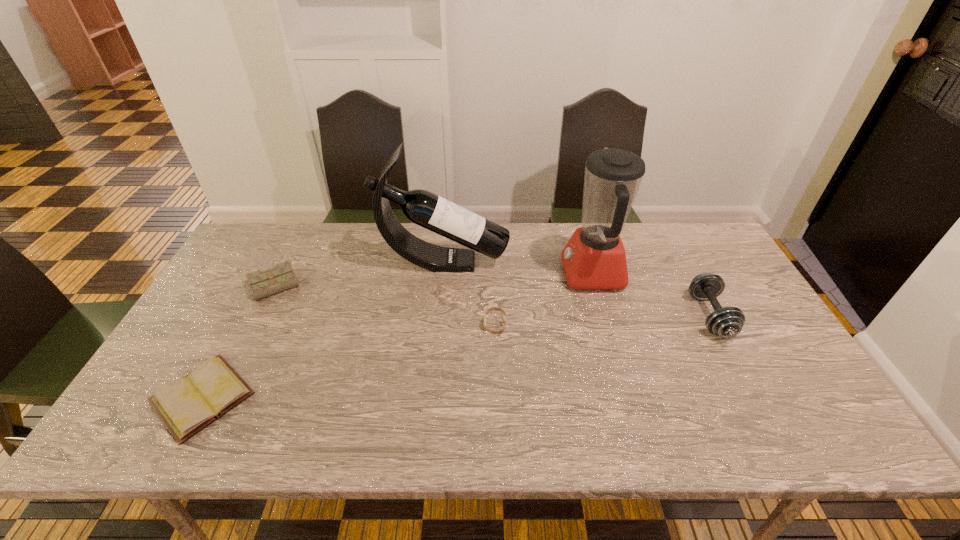
In order to click on blender in this screenshot , I will do `click(594, 258)`.

Find the location of `wine bottle`. wine bottle is located at coordinates (424, 208).

I want to click on the fourth shortest object, so click(x=727, y=322).

In order to click on the rightmost object in this screenshot , I will do `click(727, 322)`.

You are a GUI agent. You are given a task and a screenshot of the screen. Output one action in this format:
    pyautogui.click(x=<x>, y=<y>)
    Task: Click on the taller diary
    The image size is (960, 540).
    Given the screenshot: What is the action you would take?
    pyautogui.click(x=272, y=281)

This screenshot has width=960, height=540. I want to click on watch, so pyautogui.click(x=493, y=308).

This screenshot has width=960, height=540. I want to click on the nearer diary, so click(186, 406).

At what (x,y) coordinates should I click in order to perform the action: click on the shorter diary. Please return your answer as a coordinate pair (x, y). Looking at the image, I should click on tap(186, 406).

In order to click on vacant region located on the front of the second object from right to left near the controls in this screenshot , I will do `click(439, 274)`.

You are a GUI agent. You are given a task and a screenshot of the screen. Output one action in this format:
    pyautogui.click(x=<x>, y=<y>)
    Task: Click on the vacant region located on the front of the second object from right to left near the controls
    The image size is (960, 540).
    Given the screenshot: What is the action you would take?
    coord(433,274)